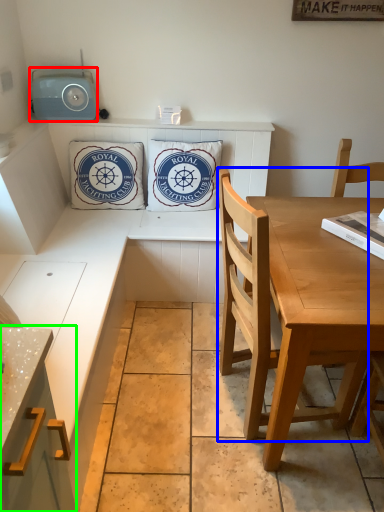
Question: Which object is positioned closest to radio (highlighted by a red box)? Select from chair (highlighted by a blue box) and cabinetry (highlighted by a green box).

Choices:
 (A) chair
 (B) cabinetry

Answer: (A)